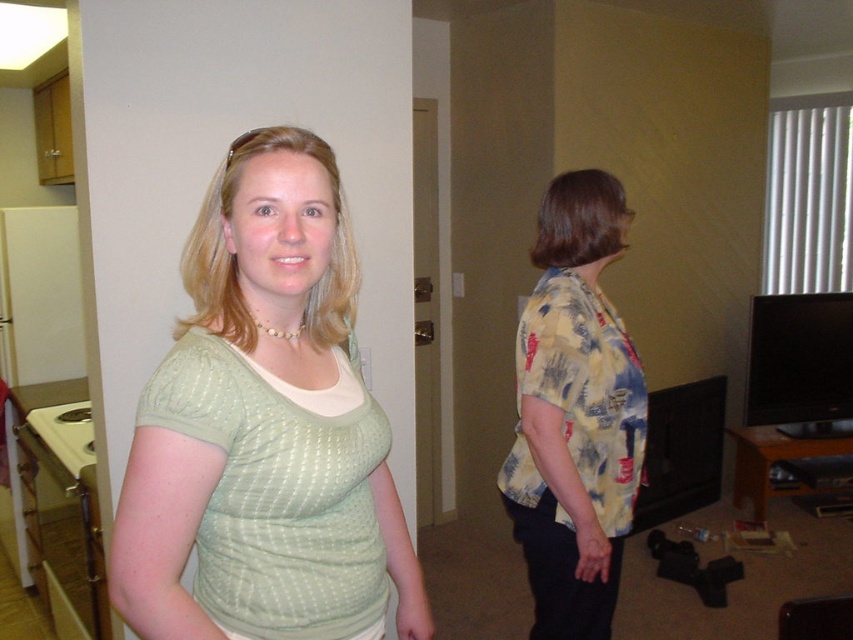
Does green textured shirt at center have a greater height compared to yellow floral shirt at right?

No.

Which of these two, green textured shirt at center or yellow floral shirt at right, stands taller?

Standing taller between the two is yellow floral shirt at right.

Measure the distance between point (131, 464) and camera.

1.02 meters

The height and width of the screenshot is (640, 853). I want to click on green textured shirt at center, so point(264,428).